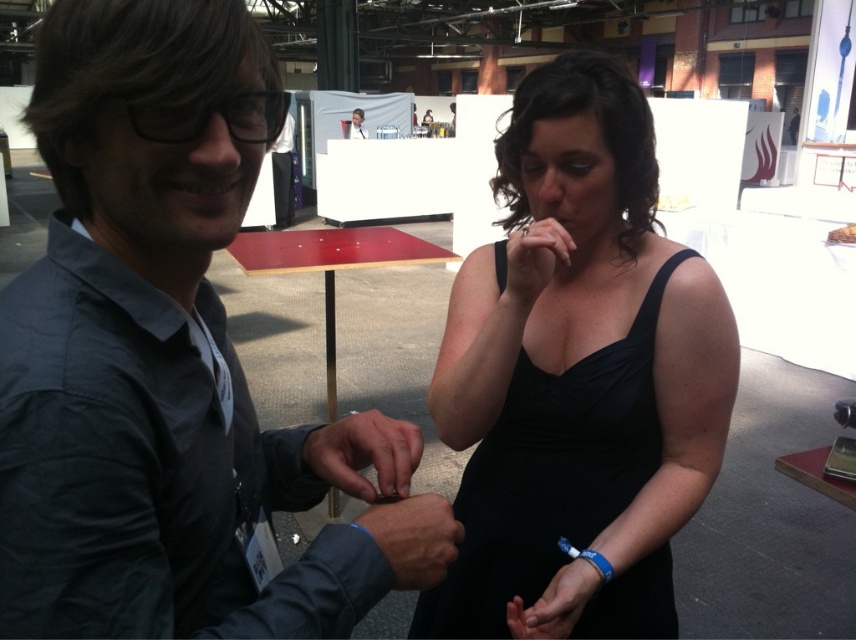
Question: Which point appears closest to the camera in this image?

Choices:
 (A) (360, 129)
 (B) (340, 468)

Answer: (B)

Question: Is matte black hand at center bigger than matte black shirt at center?

Choices:
 (A) no
 (B) yes

Answer: (A)

Question: Can you confirm if blue wristband at lower center is wider than matte black shirt at center?

Choices:
 (A) no
 (B) yes

Answer: (A)

Question: Is black satin dress at center smaller than matte black hand at center?

Choices:
 (A) yes
 (B) no

Answer: (B)

Question: Estimate the real-world distances between objects in this image. Which object is closer to the matte gray shirt at center?

Choices:
 (A) matte black shirt at center
 (B) matte black dress at center
 (C) blue wristband at lower center
 (D) matte blue fabric at center

Answer: (D)

Question: Which object appears closest to the camera in this image?

Choices:
 (A) matte black hand at center
 (B) matte black shirt at center

Answer: (A)